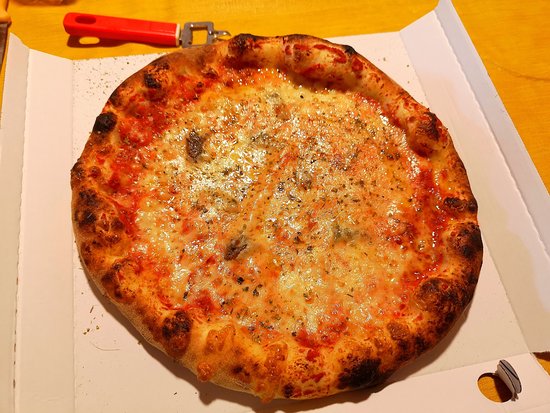
Where is `hole in handle to hang bottle opener`? The image size is (550, 413). hole in handle to hang bottle opener is located at coordinates pyautogui.click(x=84, y=19).